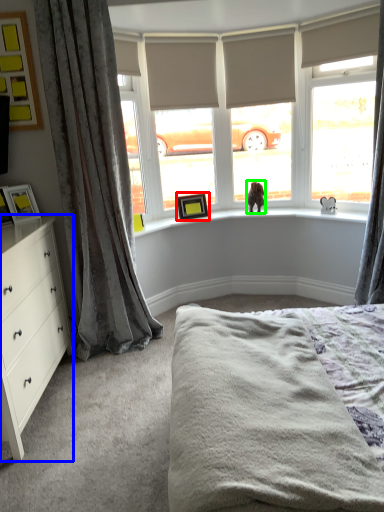
Question: Which is farther away from picture frame (highlighted by a red box)? chest of drawers (highlighted by a blue box) or animal (highlighted by a green box)?

Choices:
 (A) chest of drawers
 (B) animal

Answer: (A)